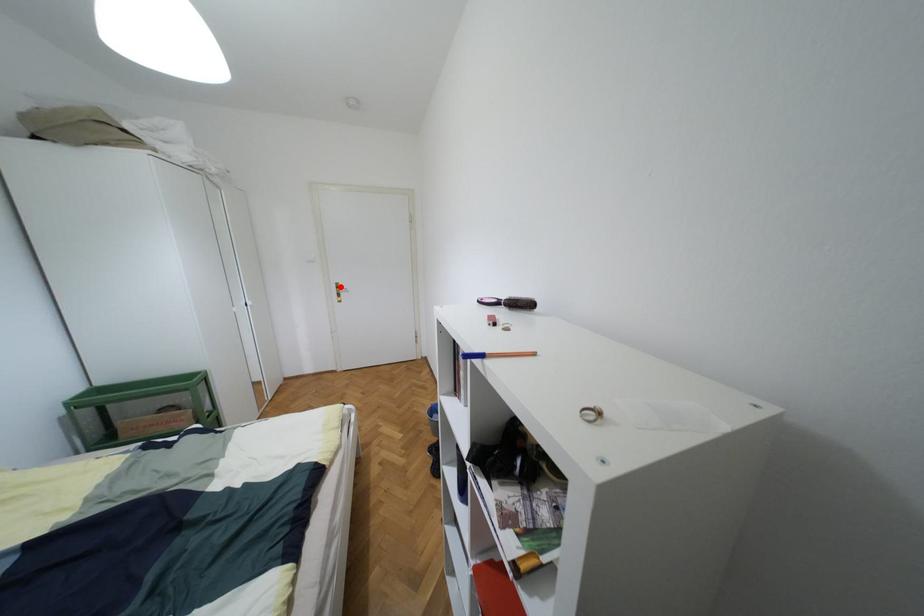
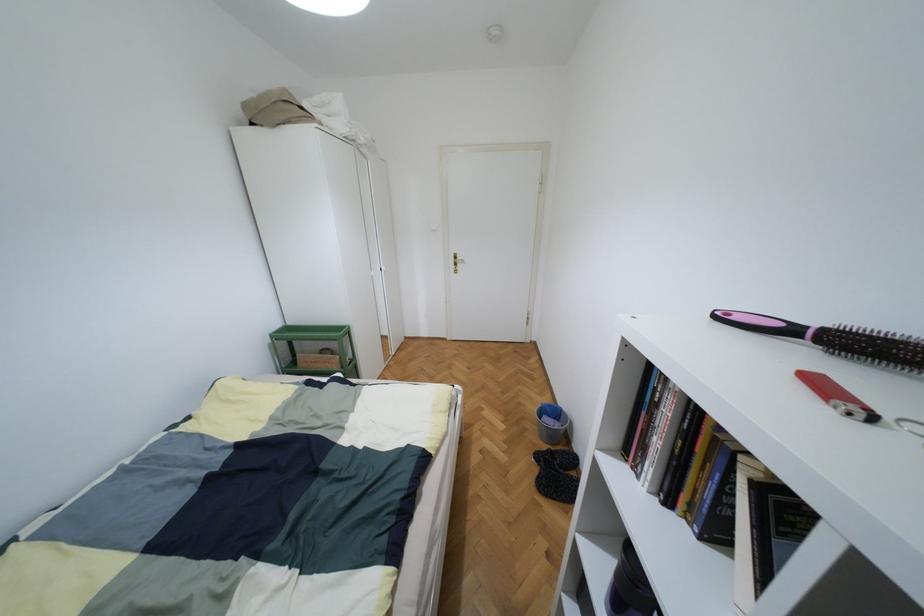
The point at the highlighted location is marked in the first image. Where is the corresponding point in the second image?

(457, 257)